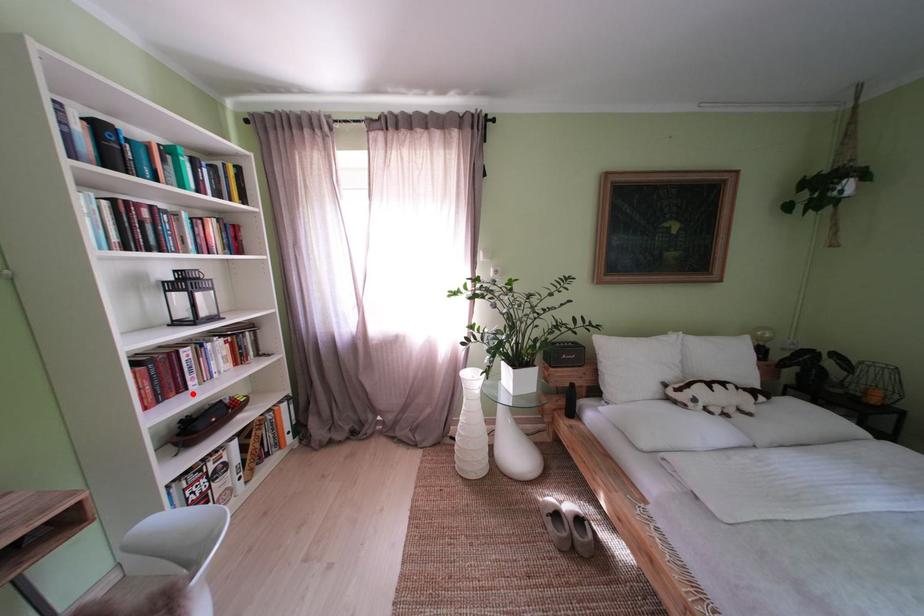
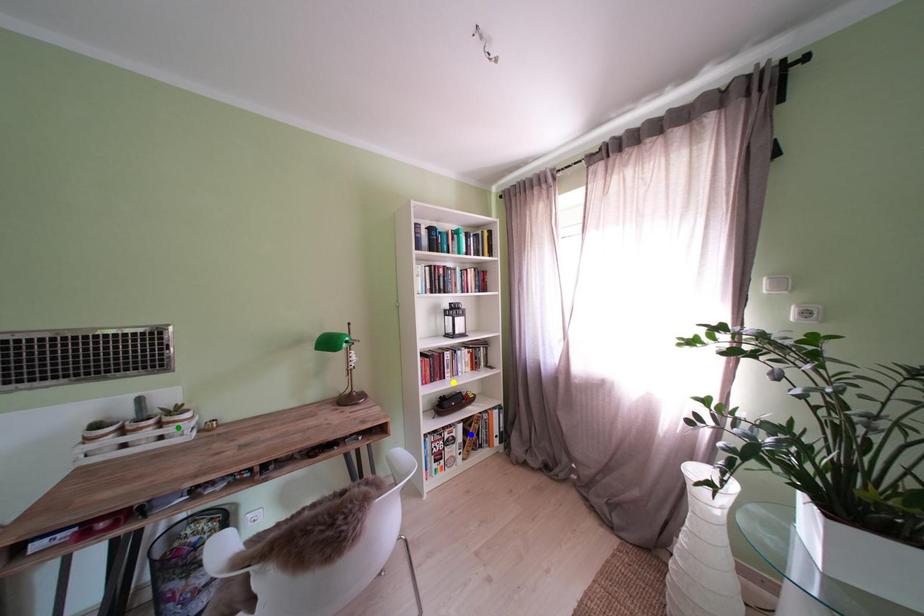
Question: I am providing you with two images of the same scene from different viewpoints. A red point is marked on the first image. You are given multiple points on the second image. In image 2, which mark is for the same physical point as the one in image 1?

Choices:
 (A) blue point
 (B) green point
 (C) yellow point

Answer: (C)